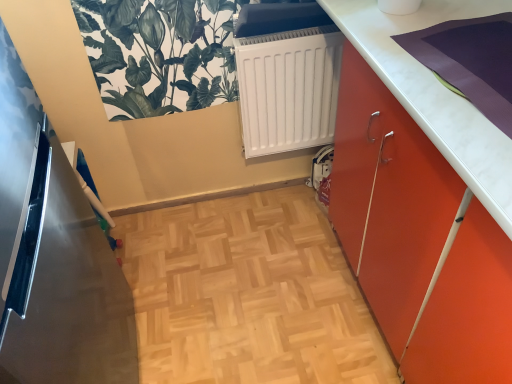
Locate an element on the screen. unoccupied region to the right of metallic refrigerator at left is located at coordinates (249, 308).